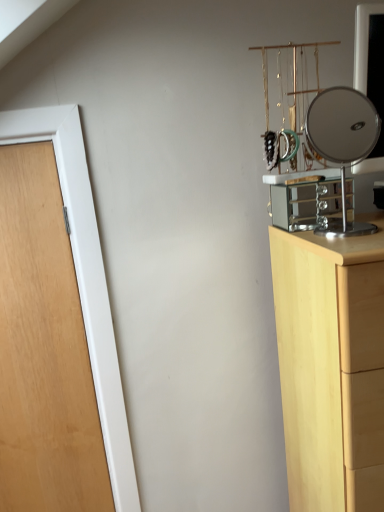
Locate an element on the screen. The image size is (384, 512). free space in front of polished silver mirror at right is located at coordinates (355, 244).